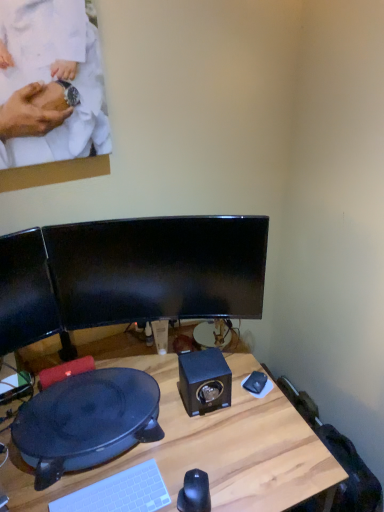
Question: Is wooden desk at center taller or shorter than black matte speaker at center?

Choices:
 (A) tall
 (B) short

Answer: (A)

Question: Based on their sizes in the image, would you say wooden desk at center is bigger or smaller than black matte speaker at center?

Choices:
 (A) small
 (B) big

Answer: (B)

Question: Estimate the real-world distances between objects in this image. Which object is closer to the black glossy monitor at center?

Choices:
 (A) black plastic wok at lower left
 (B) black matte speaker at center
 (C) black glossy mouse at lower center
 (D) white plastic keyboard at lower center
 (E) wooden desk at center

Answer: (B)

Question: Which of these objects is positioned farthest from the black glossy monitor at center?

Choices:
 (A) white plastic keyboard at lower center
 (B) wooden desk at center
 (C) black matte speaker at center
 (D) black glossy mouse at lower center
 (E) black plastic wok at lower left

Answer: (D)